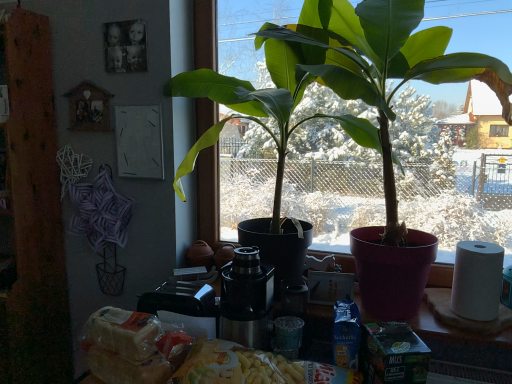
Question: Can you confirm if yellow matte pasta at lower center is shorter than green matte plant at center?

Choices:
 (A) no
 (B) yes

Answer: (B)

Question: Does yellow matte pasta at lower center have a lesser width compared to green matte plant at center?

Choices:
 (A) no
 (B) yes

Answer: (A)

Question: Is the depth of yellow matte pasta at lower center less than that of green matte plant at center?

Choices:
 (A) yes
 (B) no

Answer: (A)

Question: Is green matte plant at center a part of yellow matte pasta at lower center?

Choices:
 (A) yes
 (B) no

Answer: (B)

Question: Is yellow matte pasta at lower center smaller than green matte plant at center?

Choices:
 (A) yes
 (B) no

Answer: (A)

Question: Is yellow matte pasta at lower center positioned with its back to green matte plant at center?

Choices:
 (A) no
 (B) yes

Answer: (A)

Question: Could you tell me if stainless steel coffee machine at center is turned towards green matte plant at center?

Choices:
 (A) yes
 (B) no

Answer: (B)

Question: Are stainless steel coffee machine at center and green matte plant at center making contact?

Choices:
 (A) yes
 (B) no

Answer: (B)

Question: Is stainless steel coffee machine at center far from green matte plant at center?

Choices:
 (A) no
 (B) yes

Answer: (A)

Question: Can you confirm if stainless steel coffee machine at center is shorter than green matte plant at center?

Choices:
 (A) no
 (B) yes

Answer: (B)

Question: Is stainless steel coffee machine at center thinner than green matte plant at center?

Choices:
 (A) yes
 (B) no

Answer: (B)

Question: Considering the relative positions of stainless steel coffee machine at center and green matte plant at center in the image provided, is stainless steel coffee machine at center to the left of green matte plant at center from the viewer's perspective?

Choices:
 (A) yes
 (B) no

Answer: (A)

Question: Does green matte plant at center contain stainless steel coffee machine at center?

Choices:
 (A) no
 (B) yes

Answer: (A)